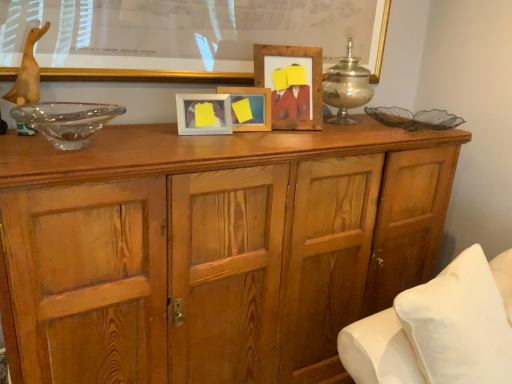
You are a GUI agent. You are given a task and a screenshot of the screen. Output one action in this format:
    pyautogui.click(x=<x>, y=<y>)
    Task: Click on the free space in front of silver metallic candle holder at upper center
    The image size is (512, 384).
    Given the screenshot: What is the action you would take?
    coord(355,124)